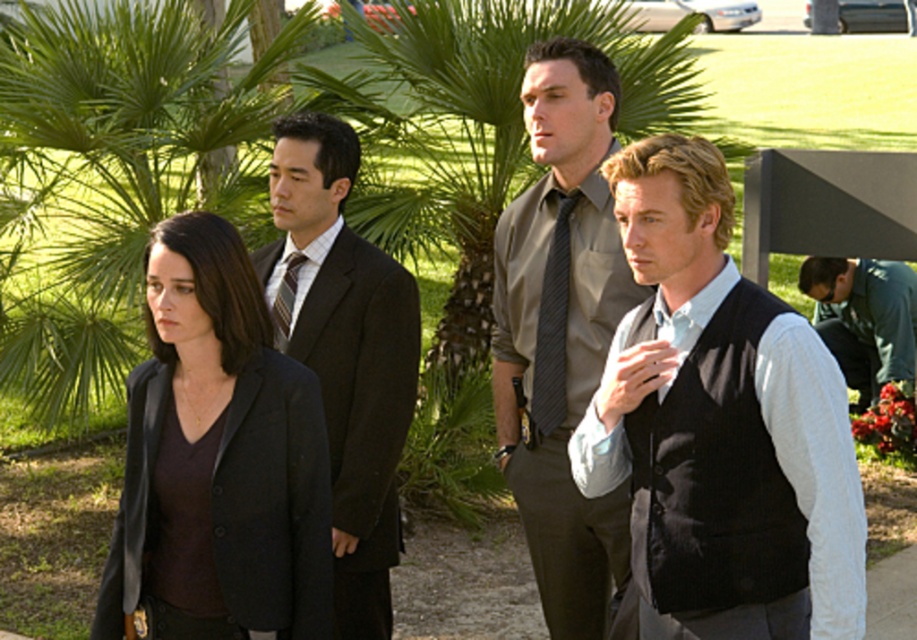
Can you confirm if black textured vest at center is shorter than striped silk tie at center?

No, black textured vest at center is not shorter than striped silk tie at center.

Looking at this image, can you confirm if black textured vest at center is wider than striped silk tie at center?

Yes.

This screenshot has width=917, height=640. Identify the location of black textured vest at center. (720, 426).

Find the location of a particular element. The image size is (917, 640). black textured vest at center is located at coordinates (720, 426).

Where is `dark gray striped tie at center`? The height and width of the screenshot is (640, 917). dark gray striped tie at center is located at coordinates (551, 326).

Is dark gray striped tie at center further to the viewer compared to striped silk tie at center?

No, dark gray striped tie at center is closer to the viewer.

At what (x,y) coordinates should I click in order to perform the action: click on dark gray striped tie at center. Please return your answer as a coordinate pair (x, y). Looking at the image, I should click on (551, 326).

Is matte gray shirt at center bigger than dark gray striped tie at center?

Correct, matte gray shirt at center is larger in size than dark gray striped tie at center.

Image resolution: width=917 pixels, height=640 pixels. Describe the element at coordinates (561, 332) in the screenshot. I see `matte gray shirt at center` at that location.

Which is in front, point (558, 74) or point (562, 289)?

Point (558, 74)

Image resolution: width=917 pixels, height=640 pixels. In order to click on matte gray shirt at center in this screenshot , I will do pos(561,332).